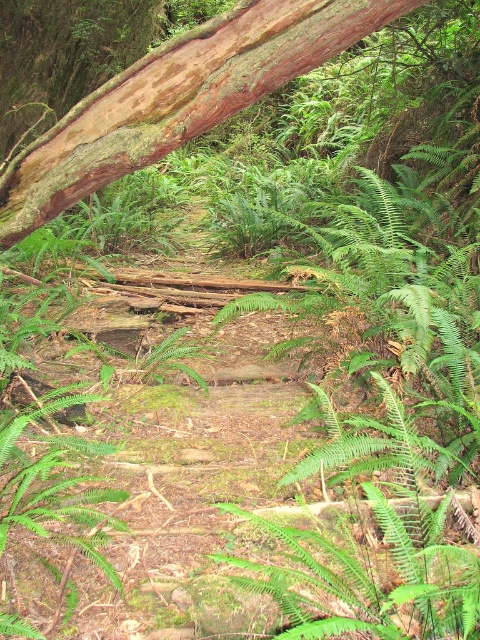
Question: Can you confirm if green leafy fern at center is positioned to the right of green leafy fern at lower left?

Choices:
 (A) no
 (B) yes

Answer: (B)

Question: Which of the following is the closest to the observer?

Choices:
 (A) brown rough bark tree trunk at upper left
 (B) green leafy fern at center
 (C) green leafy fern at lower left

Answer: (B)

Question: Can you confirm if brown rough bark tree trunk at upper left is positioned to the left of green leafy fern at lower left?

Choices:
 (A) no
 (B) yes

Answer: (A)

Question: Is brown rough bark tree trunk at upper left wider than green leafy fern at lower left?

Choices:
 (A) yes
 (B) no

Answer: (A)

Question: Which point is closer to the camera?

Choices:
 (A) green leafy fern at center
 (B) brown rough bark tree trunk at upper left

Answer: (A)

Question: Which object appears farthest from the camera in this image?

Choices:
 (A) green leafy fern at lower left
 (B) brown rough bark tree trunk at upper left
 (C) green leafy fern at center

Answer: (B)